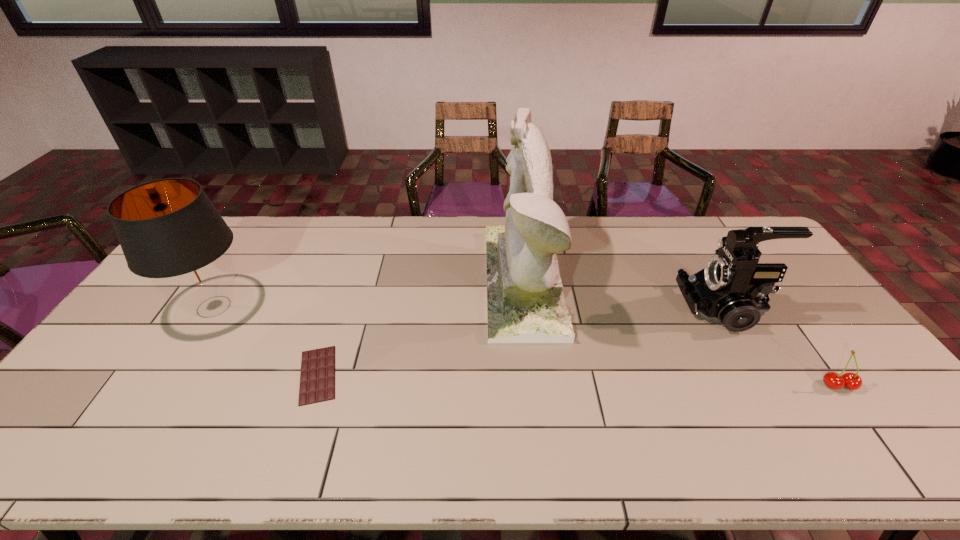
Find the location of a particular element. the tallest object is located at coordinates (525, 302).

At what (x,y) coordinates should I click in order to perform the action: click on sculpture. Please return your answer as a coordinate pair (x, y). This screenshot has width=960, height=540. Looking at the image, I should click on (525, 302).

The height and width of the screenshot is (540, 960). In order to click on the leftmost object in this screenshot , I will do `click(169, 231)`.

This screenshot has height=540, width=960. Find the location of `the second tallest object`. the second tallest object is located at coordinates (169, 231).

Image resolution: width=960 pixels, height=540 pixels. Identify the location of camcorder. pos(730,290).

This screenshot has width=960, height=540. In order to click on the third shortest object in this screenshot , I will do `click(730, 290)`.

Locate an element on the screen. The image size is (960, 540). the rightmost object is located at coordinates (851, 381).

Identify the location of cherry. The height and width of the screenshot is (540, 960). (851, 381).

Locate an element on the screen. the second object from left to right is located at coordinates click(x=317, y=378).

Where is `chocolate bar`? Image resolution: width=960 pixels, height=540 pixels. chocolate bar is located at coordinates (317, 378).